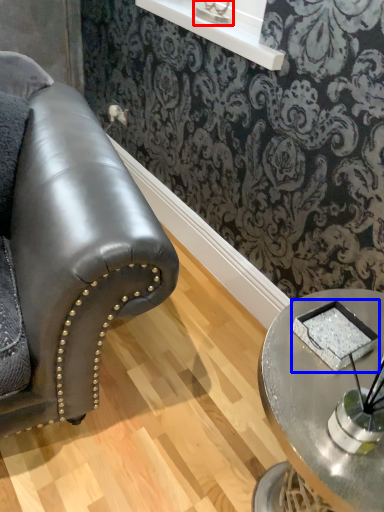
Question: Among these objects, which one is nearest to the camera, table lamp (highlighted by a red box) or pad (highlighted by a blue box)?

Choices:
 (A) table lamp
 (B) pad

Answer: (B)